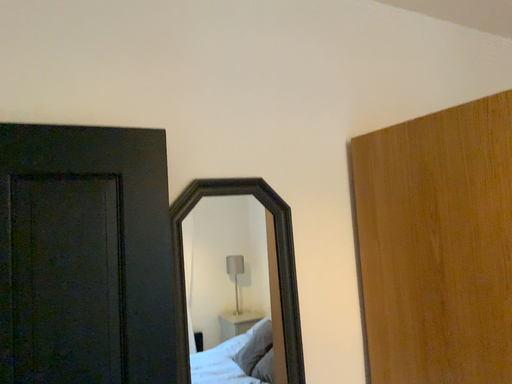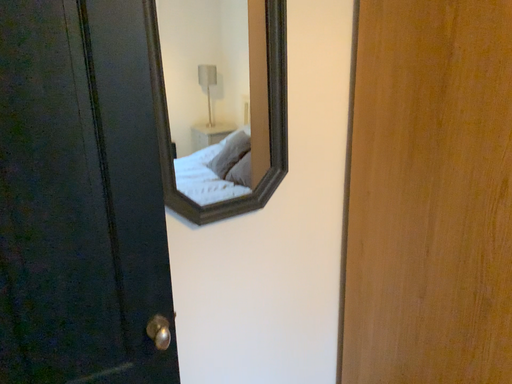
Question: Which way did the camera rotate in the video?

Choices:
 (A) rotated upward
 (B) rotated downward

Answer: (B)